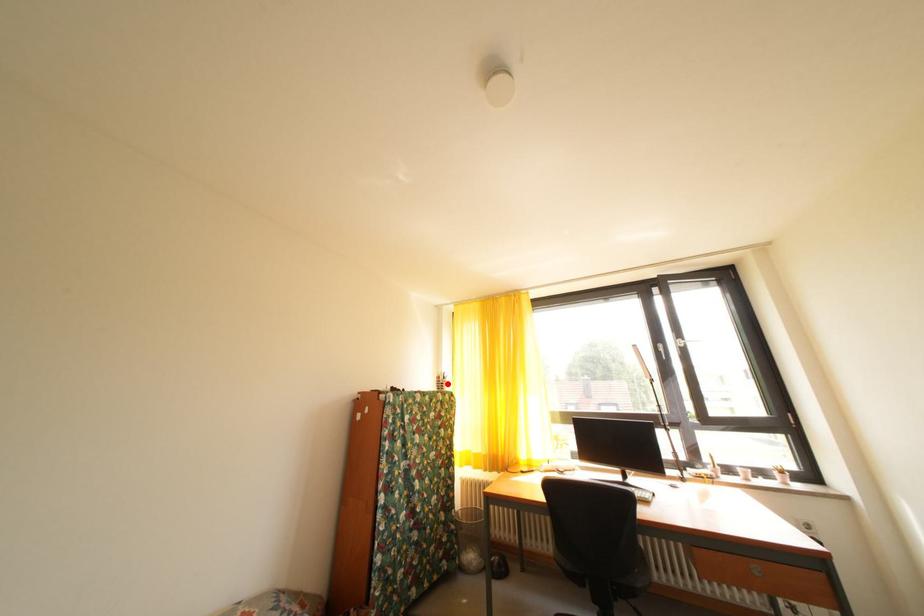
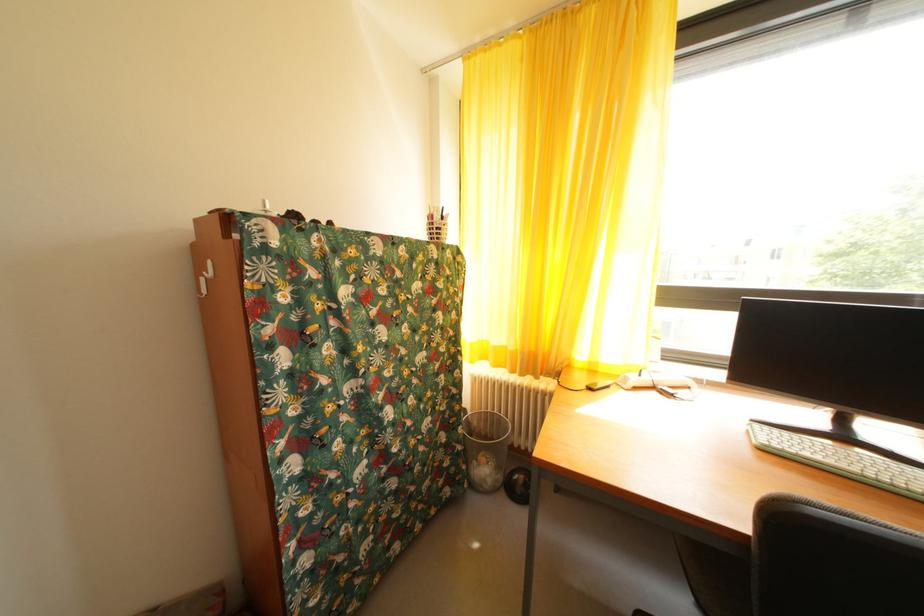
Question: A red point is marked in image1. In image2, is the corresponding 3D point closer to the camera or farther? Reply with the corresponding letter.

Choices:
 (A) The corresponding 3D point is closer.
 (B) The corresponding 3D point is farther.

Answer: (A)